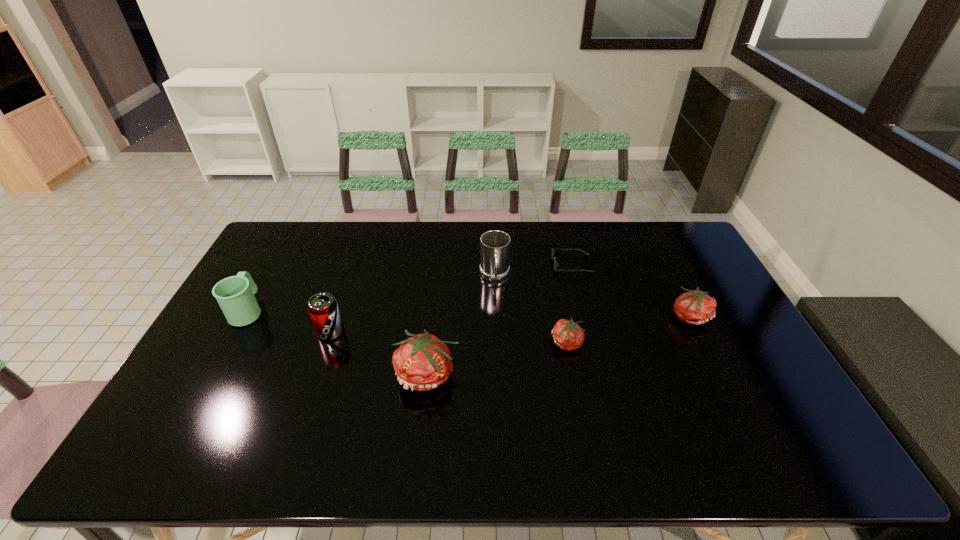
Where is `the left mug`? Image resolution: width=960 pixels, height=540 pixels. the left mug is located at coordinates (235, 295).

Locate an element on the screen. Image resolution: width=960 pixels, height=540 pixels. the nearer mug is located at coordinates (235, 295).

What are the coordinates of `vacant space located 0.220m on the right of the tallest tomato` in the screenshot? It's located at (540, 375).

The image size is (960, 540). What are the coordinates of `vacant space located on the front of the shortest tomato` in the screenshot? It's located at (580, 410).

Find the location of a particular element. vacant region located on the front of the second shortest tomato is located at coordinates (742, 422).

At what (x,y) coordinates should I click in order to perform the action: click on free space located 0.140m on the front-facing side of the shortest object. Please return your answer as a coordinate pair (x, y). This screenshot has width=960, height=540. Looking at the image, I should click on (513, 265).

This screenshot has width=960, height=540. What are the coordinates of `free space located 0.060m on the front-facing side of the shortest object` in the screenshot? It's located at (536, 265).

This screenshot has width=960, height=540. I want to click on vacant position located 0.300m on the front-facing side of the shortest object, so click(467, 265).

Where is `free space located 0.170m on the side of the farther mug with the handle`? This screenshot has width=960, height=540. free space located 0.170m on the side of the farther mug with the handle is located at coordinates (496, 330).

Find the location of a particular element. vacant space located on the left of the soda can is located at coordinates (280, 332).